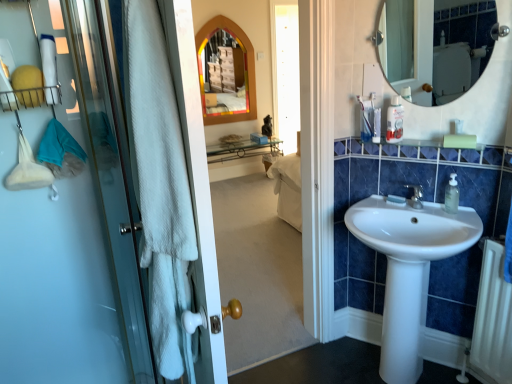
Question: Relative to white glossy sink at center, is white glossy mirror at upper right in front or behind?

Choices:
 (A) behind
 (B) front

Answer: (A)

Question: From a real-world perspective, is white glossy mirror at upper right positioned above or below white glossy sink at center?

Choices:
 (A) below
 (B) above

Answer: (B)

Question: Considering the real-world distances, which object is farthest from the multicolored glass medicine cabinet at center?

Choices:
 (A) white glossy mirror at upper right
 (B) white textured towel at left
 (C) clear plastic bottle at upper right
 (D) clear plastic bottle at upper right
 (E) white metallic radiator at lower right

Answer: (E)

Question: Considering the real-world distances, which object is farthest from the multicolored glass medicine cabinet at center?

Choices:
 (A) clear plastic bottle at upper right
 (B) white metallic radiator at lower right
 (C) white matte soap at sink right
 (D) white textured towel at left
 (E) clear plastic bottle at upper right

Answer: (B)